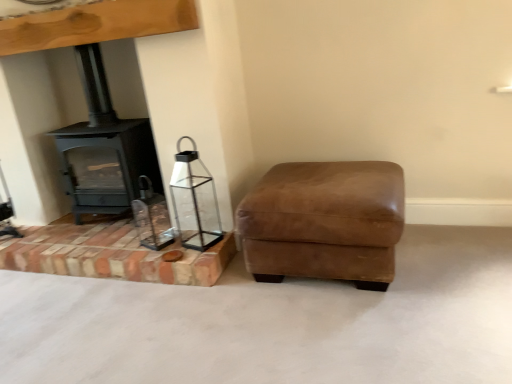
Image resolution: width=512 pixels, height=384 pixels. I want to click on free space to the back side of clear glass lantern at lower left, so click(x=198, y=230).